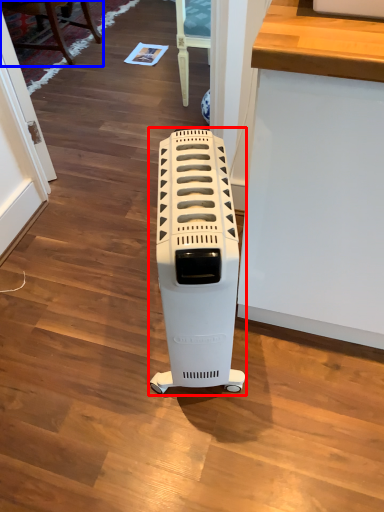
Question: Which object appears closest to the camera in this image, home appliance (highlighted by a red box) or furniture (highlighted by a blue box)?

Choices:
 (A) home appliance
 (B) furniture

Answer: (A)